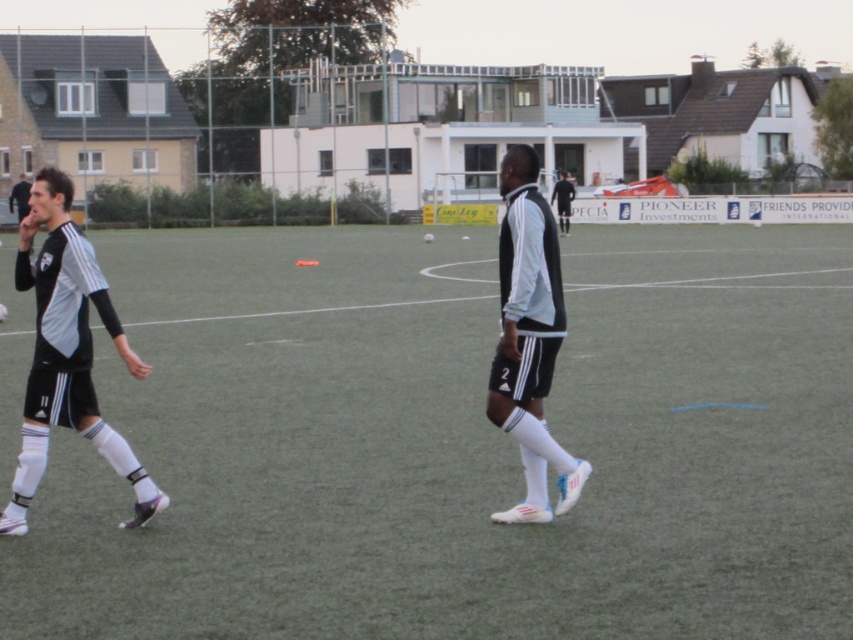
You are a soccer coach analyzing the training session. You notice two points marked on the field at coordinates point (257,307) and point (560,268). Which point is closer to the camera you are using to film the session?

Point (560,268) is closer to the camera because the description states that point (257,307) is further away from it.

You are a soccer coach observing the training session. You notice the green artificial turf at center and the black matte jersey at left. Which object is higher in elevation?

The green artificial turf at center is much taller than the black matte jersey at left, so the green artificial turf at center is higher in elevation.

You are a soccer coach observing the training session. You notice the green artificial turf at center and the black matte jersey at left. Which object is positioned higher in the image?

The green artificial turf at center is positioned higher than the black matte jersey at left in the image.